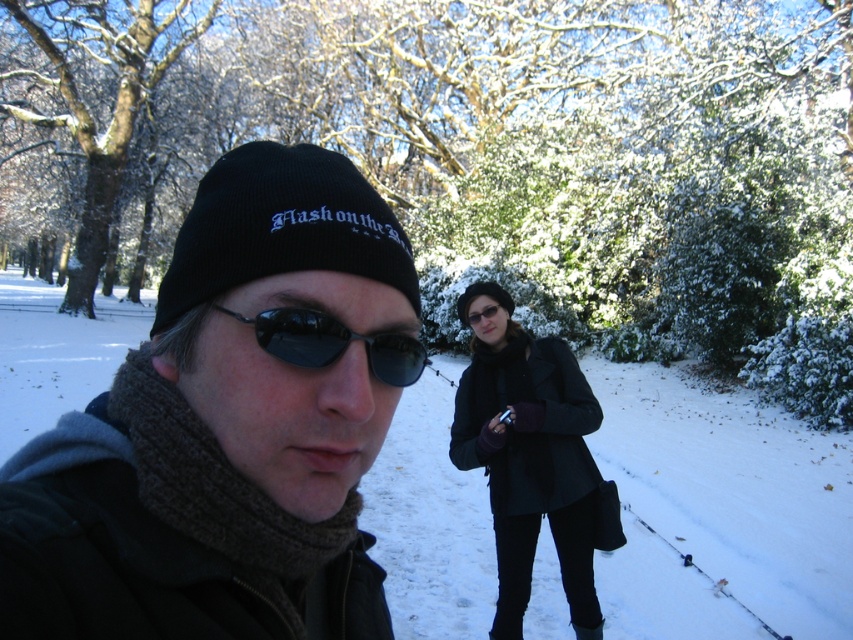
Based on the coordinates provided, where is the black knit cap at center located in the image?

The black knit cap at center is located at the 2D coordinates point [229,426] in the image.

You are a fashion designer analyzing winter clothing. You observe the black knit cap at center and the black matte coat at center in the image. Which of these two items appears to be smaller in size?

The black knit cap at center has a smaller size compared to the black matte coat at center, so the black knit cap at center appears smaller.